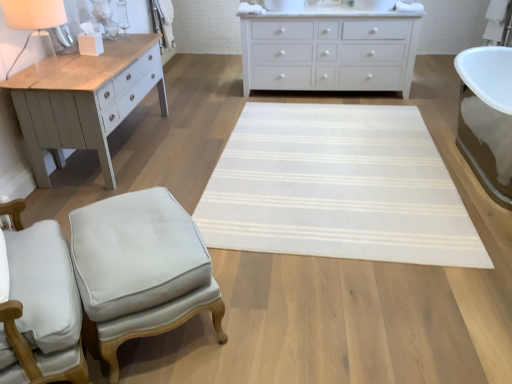
This screenshot has width=512, height=384. In order to click on spots to the right of light gray fabric stool at lower left in this screenshot , I will do `click(274, 296)`.